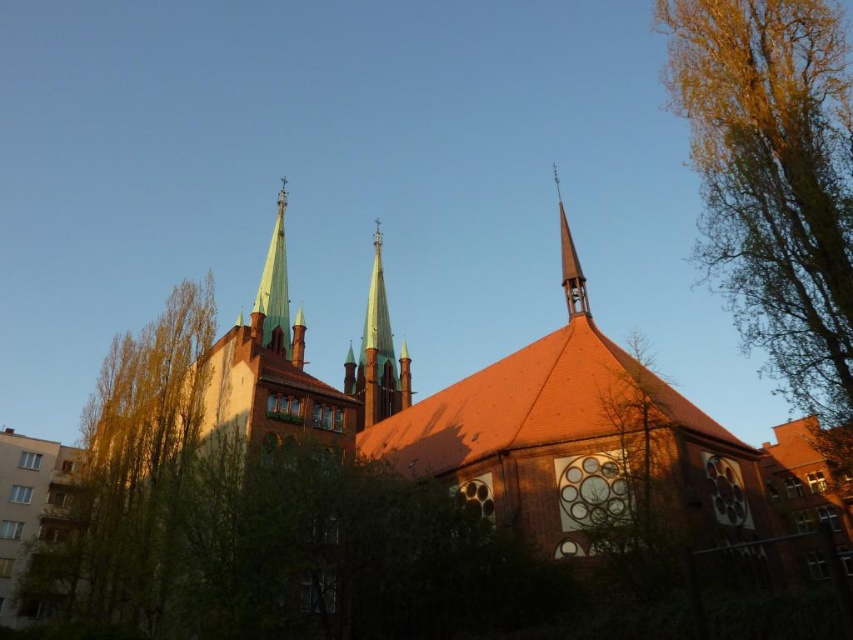
Based on the photo, you are standing in front of the church and notice a green leafy tree at left and a smooth orange spire at center. Which object is taller?

The green leafy tree at left is much taller than the smooth orange spire at center.

You are a drone operator tasked with capturing aerial footage of the brown brick church at center and the smooth glass spire at center. Your drone has a maximum flight range of 30 meters. Can you fly the drone from the church to the spire without exceeding its range?

The distance between the brown brick church at center and the smooth glass spire at center is 29.80 meters, which is within the drone operator s 30 meters maximum flight range. Yes, the drone can fly from the brown brick church at center to the smooth glass spire at center without exceeding its range.